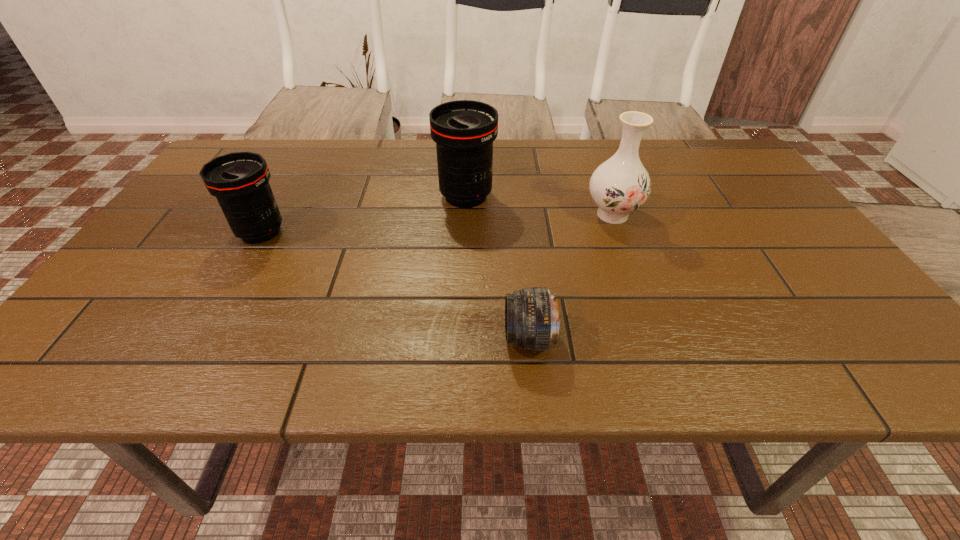
You are a GUI agent. You are given a task and a screenshot of the screen. Output one action in this format:
    pyautogui.click(x=<x>, y=<y>)
    Task: Click on the vacant area between the shortest telephoto lens and the leftmost telephoto lens
    The image size is (960, 540).
    Given the screenshot: What is the action you would take?
    pyautogui.click(x=395, y=285)

You are a GUI agent. You are given a task and a screenshot of the screen. Output one action in this format:
    pyautogui.click(x=<x>, y=<y>)
    Task: Click on the vacant area that lies between the second nearest telephoto lens and the shortest object
    Image resolution: width=960 pixels, height=540 pixels.
    Given the screenshot: What is the action you would take?
    pyautogui.click(x=395, y=285)

Find the location of a particular element. This screenshot has width=960, height=540. free spot between the nearest telephoto lens and the vase is located at coordinates (570, 276).

The image size is (960, 540). I want to click on free space between the nearest telephoto lens and the farthest telephoto lens, so pyautogui.click(x=497, y=267).

You are a GUI agent. You are given a task and a screenshot of the screen. Output one action in this format:
    pyautogui.click(x=<x>, y=<y>)
    Task: Click on the free spot between the rightmost object and the leftmost object
    
    Given the screenshot: What is the action you would take?
    pyautogui.click(x=437, y=224)

You are a GUI agent. You are given a task and a screenshot of the screen. Output one action in this format:
    pyautogui.click(x=<x>, y=<y>)
    Task: Click on the vacant area that lies between the third tallest object and the tallest telephoto lens
    The image size is (960, 540).
    Given the screenshot: What is the action you would take?
    pyautogui.click(x=363, y=214)

Locate an element on the screen. The height and width of the screenshot is (540, 960). vacant area that lies between the leftmost object and the second telephoto lens from right to left is located at coordinates (363, 214).

Locate an element on the screen. vacant space that's between the rightmost telephoto lens and the leftmost telephoto lens is located at coordinates (395, 285).

This screenshot has width=960, height=540. What are the coordinates of `object that is the closest to the nearest object` in the screenshot? It's located at (620, 185).

This screenshot has width=960, height=540. I want to click on the third closest object relative to the nearest object, so click(240, 181).